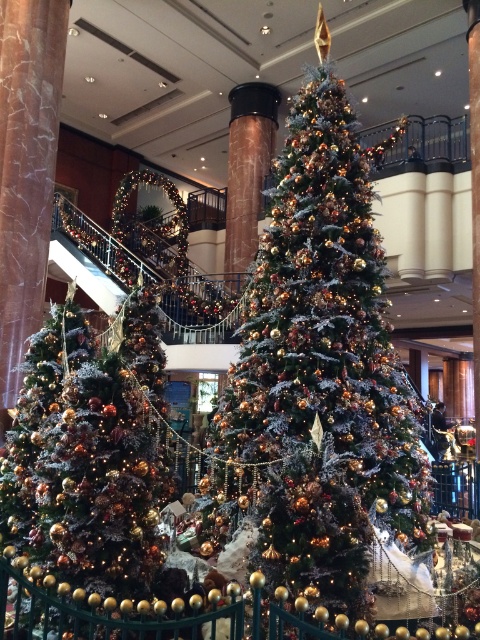
Is point (332, 198) positioned before point (24, 465)?

Yes, point (332, 198) is in front of point (24, 465).

Which of these two, frosted glass christmas tree at center or shiny gold ornaments at center, stands taller?

With more height is frosted glass christmas tree at center.

Find the location of a particular element. frosted glass christmas tree at center is located at coordinates (324, 365).